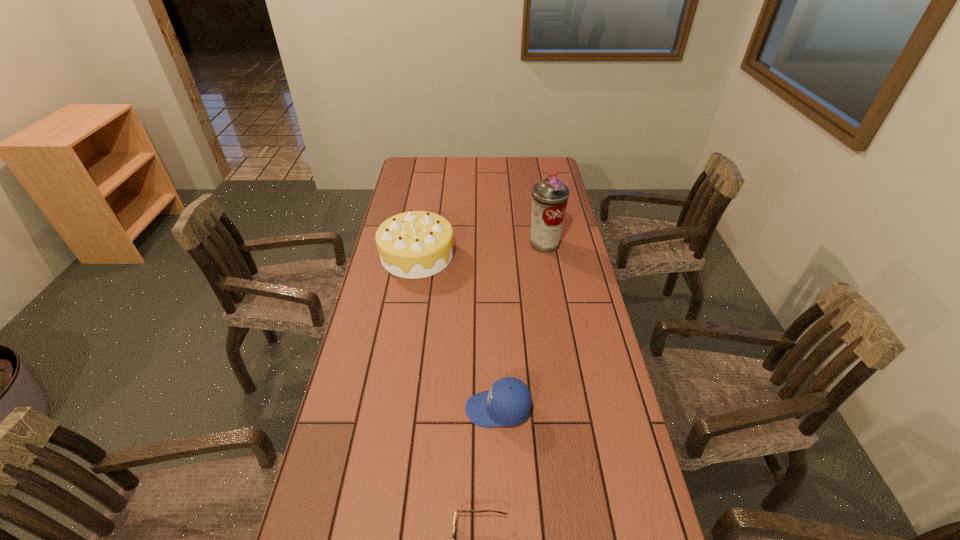
The width and height of the screenshot is (960, 540). I want to click on free point located 0.200m on the front-facing side of the cap, so click(x=388, y=409).

Locate an element on the screen. object that is at the left edge is located at coordinates (416, 244).

Find the location of `object that is at the right edge`. object that is at the right edge is located at coordinates (550, 196).

At what (x,y) coordinates should I click in order to perform the action: click on vacant space at the far edge of the desktop. Please return your answer as a coordinate pair (x, y). This screenshot has height=540, width=960. Looking at the image, I should click on (499, 167).

Find the location of `free space at the left edge`. free space at the left edge is located at coordinates (363, 420).

In the image, there is a desktop. Identify the location of vacant space at the right edge. (597, 411).

At what (x,y) coordinates should I click in order to perform the action: click on vacant region at the far right corner. Please return your answer as a coordinate pair (x, y). Looking at the image, I should click on (544, 168).

At what (x,y) coordinates should I click in order to perform the action: click on free space between the aerosol can and the cap. Please return your answer as a coordinate pair (x, y). Looking at the image, I should click on (521, 327).

You are a GUI agent. You are given a task and a screenshot of the screen. Output one action in this format:
    pyautogui.click(x=<x>, y=<y>)
    Task: Click on the unoccupied position between the birthday cake and the aerosol can
    This screenshot has height=540, width=960.
    Given the screenshot: What is the action you would take?
    pyautogui.click(x=481, y=249)

Locate an element on the screen. unoccupied area between the leftmost object and the cap is located at coordinates (458, 332).